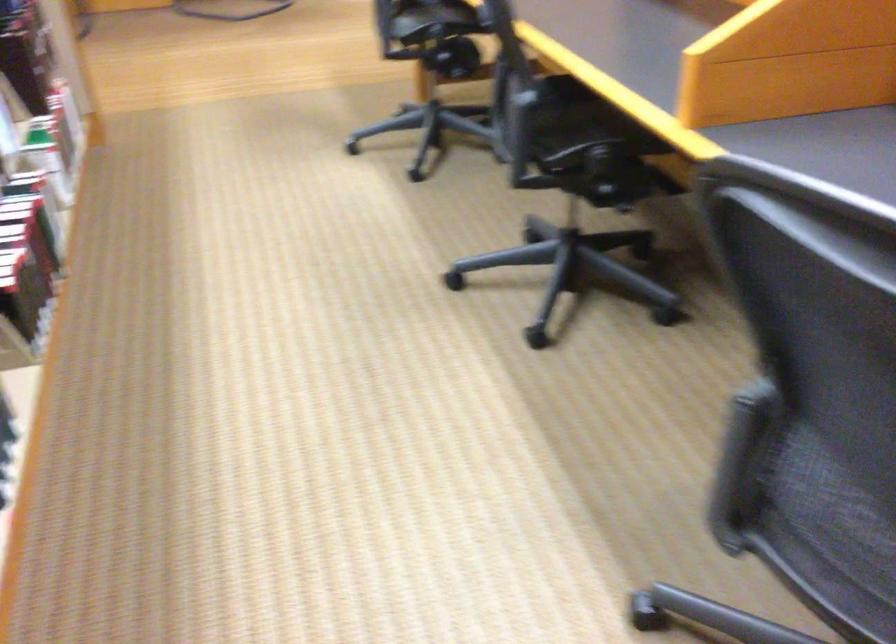
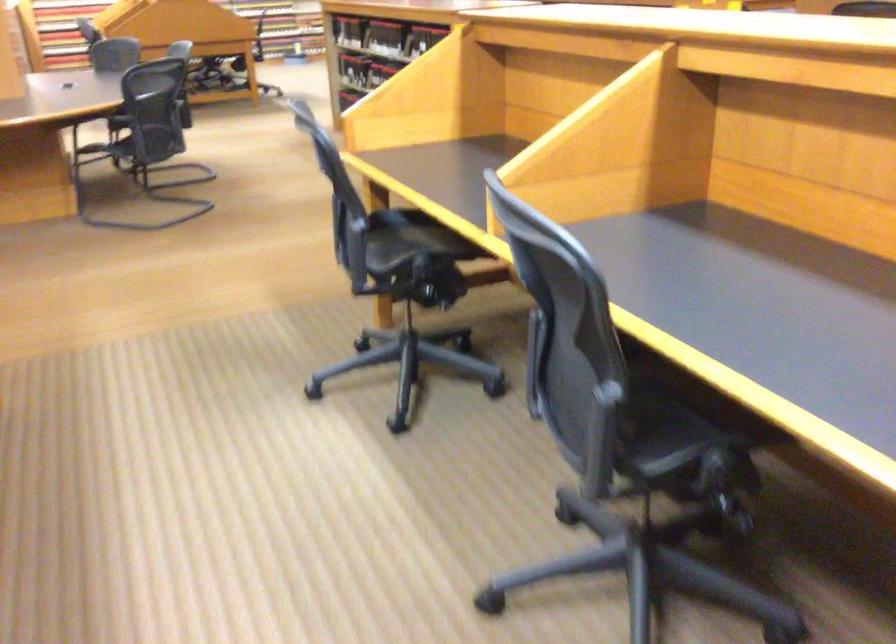
Which direction would the cameraman need to move to produce the second image?

The cameraman moved toward left, forward.